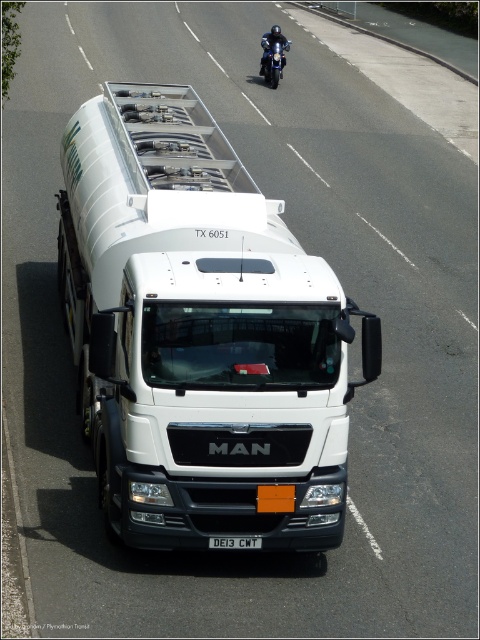
Question: Among these objects, which one is farthest from the camera?

Choices:
 (A) white plastic license plate at center
 (B) white glossy tanker at center
 (C) shiny blue motorcycle at upper center

Answer: (C)

Question: Which object is closer to the camera taking this photo?

Choices:
 (A) shiny blue motorcycle at upper center
 (B) white plastic license plate at center
 (C) white glossy tanker at center

Answer: (B)

Question: Does white plastic license plate at center have a lesser width compared to shiny blue motorcycle at upper center?

Choices:
 (A) yes
 (B) no

Answer: (A)

Question: Based on their relative distances, which object is farther from the white glossy tanker at center?

Choices:
 (A) shiny blue motorcycle at upper center
 (B) white plastic license plate at center

Answer: (A)

Question: From the image, what is the correct spatial relationship of white plastic license plate at center in relation to shiny blue motorcycle at upper center?

Choices:
 (A) below
 (B) above

Answer: (A)

Question: Does white glossy tanker at center appear on the left side of shiny blue motorcycle at upper center?

Choices:
 (A) yes
 (B) no

Answer: (A)